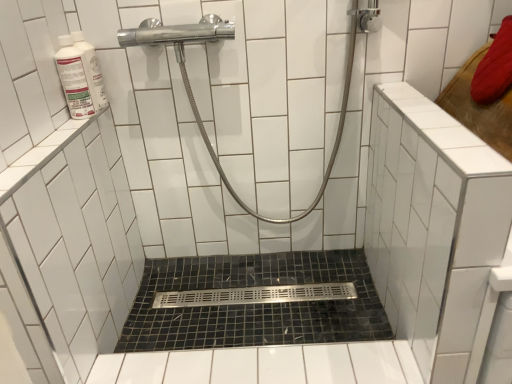
Question: Is point (64, 44) closer or farther from the camera than point (357, 16)?

Choices:
 (A) closer
 (B) farther

Answer: (A)

Question: In terms of height, does white glossy bottle at upper left look taller or shorter compared to polished chrome showerhead at upper center?

Choices:
 (A) short
 (B) tall

Answer: (A)

Question: Which object is the farthest from the white glossy bottle at upper left?

Choices:
 (A) polished chrome showerhead at upper center
 (B) black mosaic tile bath at center

Answer: (B)

Question: Estimate the real-world distances between objects in this image. Which object is farther from the polished chrome showerhead at upper center?

Choices:
 (A) white glossy bottle at upper left
 (B) black mosaic tile bath at center

Answer: (B)